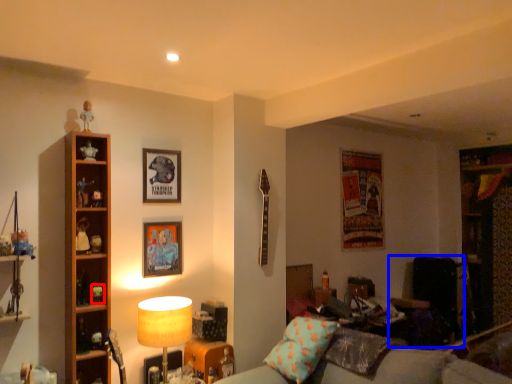
Question: Which point is further to the camera, toy (highlighted by a red box) or swivel chair (highlighted by a blue box)?

Choices:
 (A) toy
 (B) swivel chair

Answer: (B)